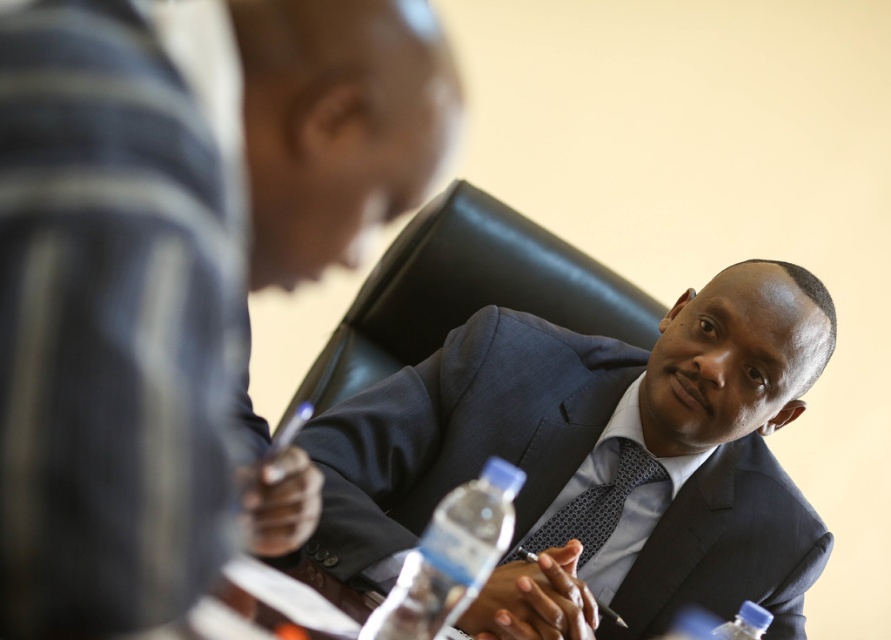
Does point (799, 630) come farther from viewer compared to point (642, 456)?

Yes, it is.

Does dark blue textured suit at center have a greater width compared to dark blue textured tie at center?

Yes, dark blue textured suit at center is wider than dark blue textured tie at center.

Between point (484, 371) and point (583, 560), which one is positioned behind?

The point (484, 371) is more distant.

Identify the location of dark blue textured suit at center. The height and width of the screenshot is (640, 891). [460, 429].

What do you see at coordinates (450, 557) in the screenshot? I see `clear plastic bottle at lower center` at bounding box center [450, 557].

Does clear plastic bottle at lower center have a greater width compared to dark blue textured tie at center?

In fact, clear plastic bottle at lower center might be narrower than dark blue textured tie at center.

Does point (481, 541) come closer to viewer compared to point (619, 467)?

Yes, point (481, 541) is in front of point (619, 467).

Where is `clear plastic bottle at lower center`? clear plastic bottle at lower center is located at coordinates (450, 557).

Can you confirm if dark blue textured suit at center is bigger than clear plastic bottle at lower center?

Indeed, dark blue textured suit at center has a larger size compared to clear plastic bottle at lower center.

Between dark blue textured suit at center and clear plastic bottle at lower center, which one has more height?

dark blue textured suit at center

In order to click on dark blue textured suit at center in this screenshot , I will do `click(460, 429)`.